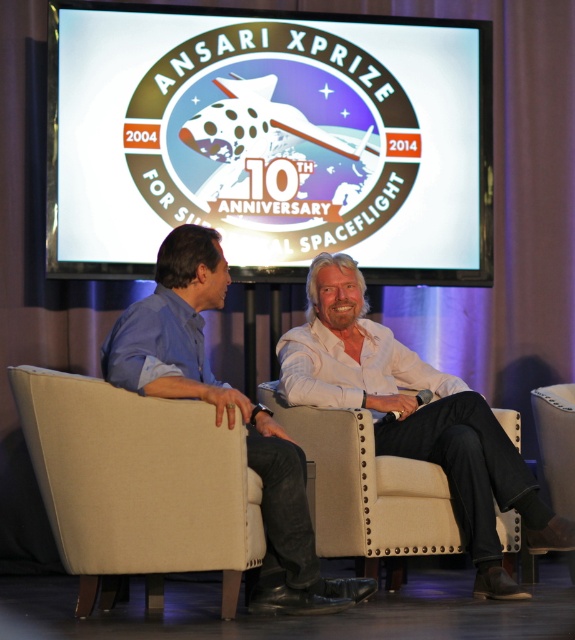
Can you confirm if white glossy screen at upper center is positioned to the left of beige fabric armchair at lower left?

No, white glossy screen at upper center is not to the left of beige fabric armchair at lower left.

I want to click on white glossy screen at upper center, so click(270, 140).

Does white leather chair at center appear on the left side of beige fabric armchair at lower right?

Indeed, white leather chair at center is positioned on the left side of beige fabric armchair at lower right.

Who is more distant from viewer, (154, 316) or (566, 419)?

The point (566, 419) is behind.

You are a GUI agent. You are given a task and a screenshot of the screen. Output one action in this format:
    pyautogui.click(x=<x>, y=<y>)
    Task: Click on the white leather chair at center
    
    Given the screenshot: What is the action you would take?
    pyautogui.click(x=227, y=416)

Is beige fabric armchair at lower left smaller than white leather chair at center?

Yes, beige fabric armchair at lower left is smaller than white leather chair at center.

Can you confirm if beige fabric armchair at lower left is positioned above white leather chair at center?

Actually, beige fabric armchair at lower left is below white leather chair at center.

Does point (233, 538) come in front of point (286, 612)?

Yes, it is.

Identify the location of beige fabric armchair at lower left. (139, 484).